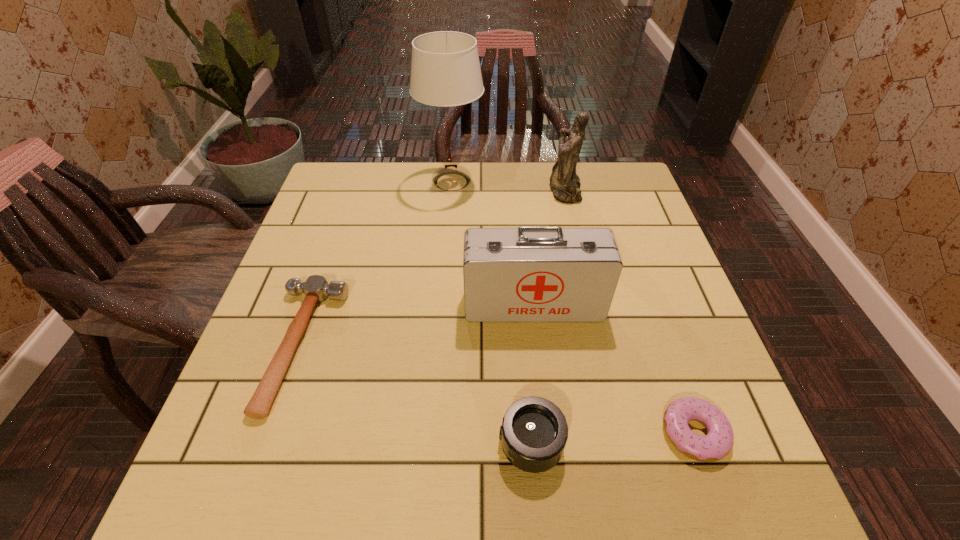
You are a GUI agent. You are given a task and a screenshot of the screen. Output one action in this format:
    pyautogui.click(x=<x>, y=<y>)
    Task: Click on the tallest object
    
    Given the screenshot: What is the action you would take?
    pyautogui.click(x=445, y=70)

At what (x,y) coordinates should I click in order to perform the action: click on figurine. Please return your answer as a coordinate pair (x, y). Looking at the image, I should click on pyautogui.click(x=565, y=184).

Locate an element on the screen. the first-aid kit is located at coordinates (527, 274).

Find the location of a particular element. This screenshot has height=540, width=960. telephoto lens is located at coordinates point(534,431).

You are a GUI agent. You are given a task and a screenshot of the screen. Output one action in this format:
    pyautogui.click(x=<x>, y=<y>)
    Task: Click on the leftmost object
    The width and height of the screenshot is (960, 540).
    Given the screenshot: What is the action you would take?
    pyautogui.click(x=316, y=288)

What are the coordinates of `the fifth tallest object` in the screenshot? It's located at (316, 288).

The height and width of the screenshot is (540, 960). What are the coordinates of `the shortest object` in the screenshot? It's located at (718, 442).

This screenshot has width=960, height=540. I want to click on doughnut, so click(x=718, y=442).

Identify the location of free space located on the front-facing side of the tallest object. (582, 182).

What are the coordinates of `vacant position located on the front-facing side of the figurine` in the screenshot? It's located at (417, 190).